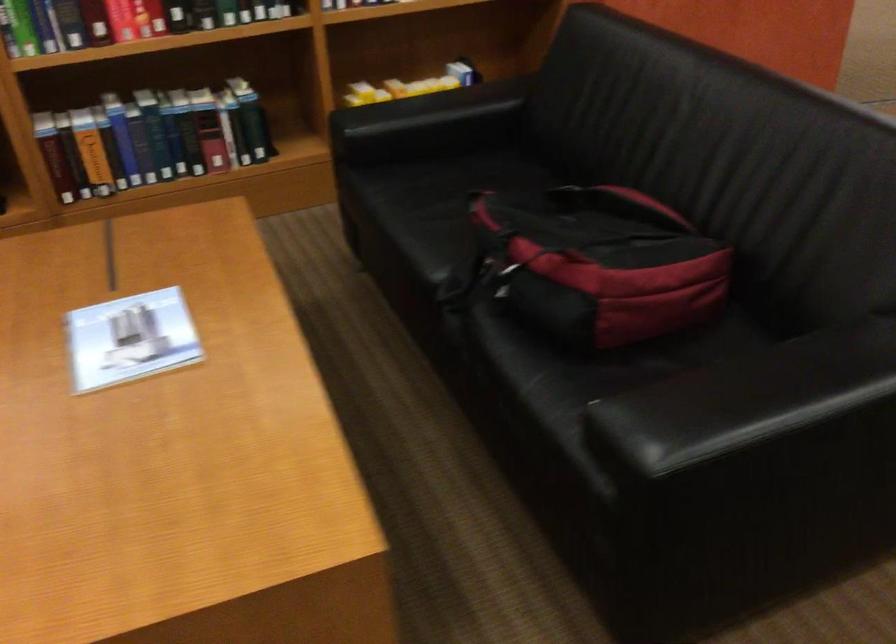
Find where to pull the red backpack handle. Please return your answer as a coordinate pair (x, y).

(495, 269)